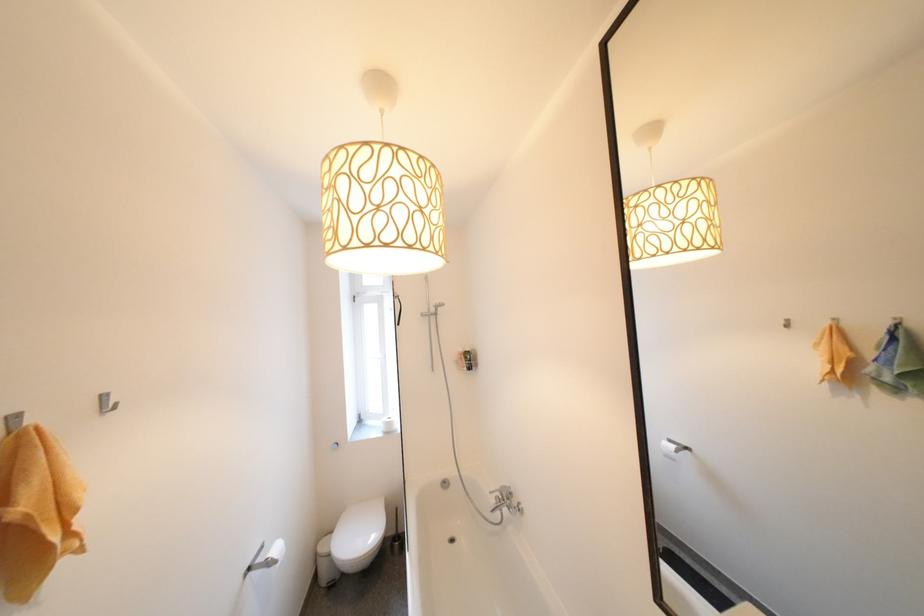
Where would you lift the handheld shower head? Please return your answer as a coordinate pair (x, y).

(432, 310)